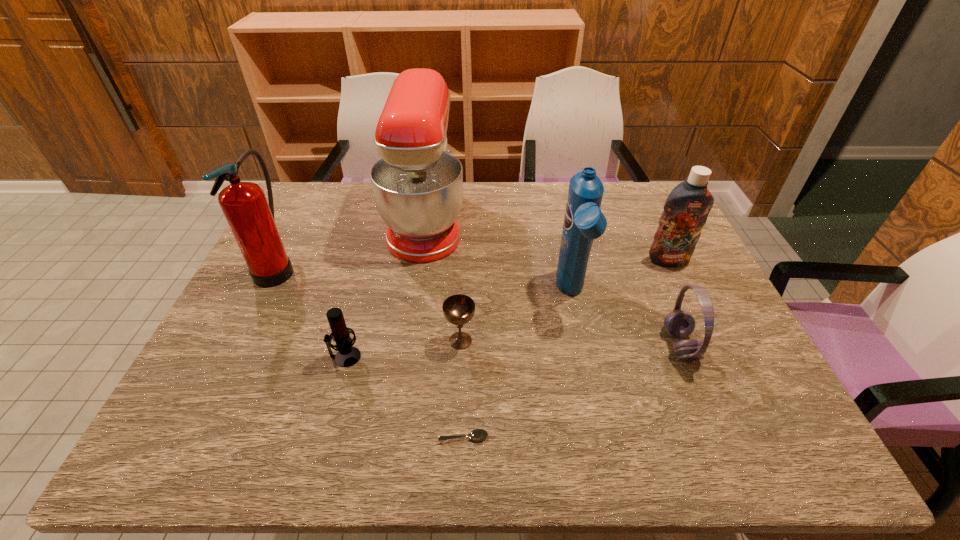
The width and height of the screenshot is (960, 540). What are the coordinates of `mixer` in the screenshot? It's located at (417, 183).

Identify the location of fire extinguisher. The height and width of the screenshot is (540, 960). (251, 220).

Locate an element on the screen. the taller shampoo is located at coordinates (584, 221).

Find the location of a particular element. The image size is (960, 540). the nearer shampoo is located at coordinates (584, 221).

You are a GUI agent. You are given a task and a screenshot of the screen. Output one action in this format:
    pyautogui.click(x=<x>, y=<y>)
    Task: Click on the farther shampoo
    Image resolution: width=960 pixels, height=540 pixels.
    Given the screenshot: What is the action you would take?
    pyautogui.click(x=686, y=209)

Image resolution: width=960 pixels, height=540 pixels. What are the coordinates of `the shorter shampoo` in the screenshot? It's located at (686, 209).

You are a GUI agent. You are given a task and a screenshot of the screen. Output one action in this format:
    pyautogui.click(x=<x>, y=<y>)
    Task: Click on the headset
    The height and width of the screenshot is (540, 960).
    Given the screenshot: What is the action you would take?
    pyautogui.click(x=678, y=323)

At what (x,y) coordinates should I click in order to perform the action: click on microphone. Please return your answer as a coordinate pair (x, y). The height and width of the screenshot is (540, 960). Looking at the image, I should click on [347, 355].

Locate an element on the screen. The image size is (960, 540). chalice is located at coordinates (459, 309).

Where is `soupspoon`? soupspoon is located at coordinates click(x=478, y=434).